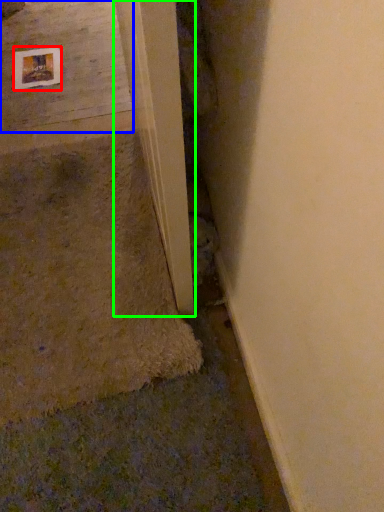
Question: Estimate the real-world distances between objects in this image. Which object is farther from picture frame (highlighted by a red box), concrete (highlighted by a blue box) or beam (highlighted by a green box)?

Choices:
 (A) concrete
 (B) beam

Answer: (B)